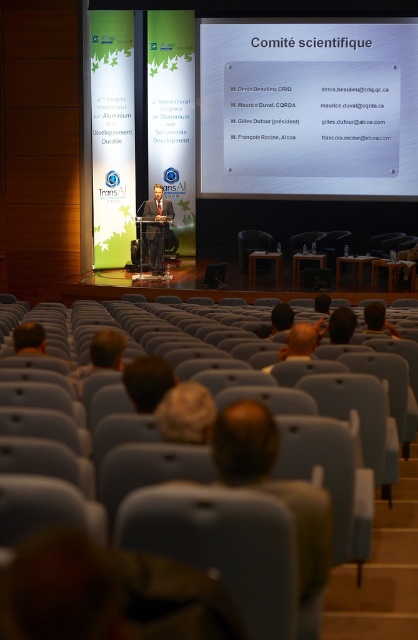
Can you confirm if light brown hair at lower center is positioned to the right of orange plush toy at center?

Incorrect, light brown hair at lower center is not on the right side of orange plush toy at center.

Is light brown hair at lower center thinner than orange plush toy at center?

Correct, light brown hair at lower center's width is less than orange plush toy at center's.

Is point (96, 348) farther from viewer compared to point (290, 348)?

No.

Identify the location of light brown hair at lower center. (99, 356).

Does white glossy projector screen at upper center come behind orange plush toy at center?

Yes, white glossy projector screen at upper center is further from the viewer.

Does white glossy projector screen at upper center have a lesser height compared to orange plush toy at center?

Yes, white glossy projector screen at upper center is shorter than orange plush toy at center.

Is point (288, 97) closer to viewer compared to point (320, 332)?

No, (288, 97) is further to viewer.

Locate an element on the screen. white glossy projector screen at upper center is located at coordinates (308, 108).

Between point (400, 161) and point (104, 330), which one is positioned in front?

Point (104, 330) is more forward.

From the picture: Can you confirm if white glossy projector screen at upper center is positioned to the left of light brown hair at lower center?

Incorrect, white glossy projector screen at upper center is not on the left side of light brown hair at lower center.

Does point (229, 56) come behind point (94, 362)?

Yes.

The width and height of the screenshot is (418, 640). Identify the location of white glossy projector screen at upper center. (308, 108).